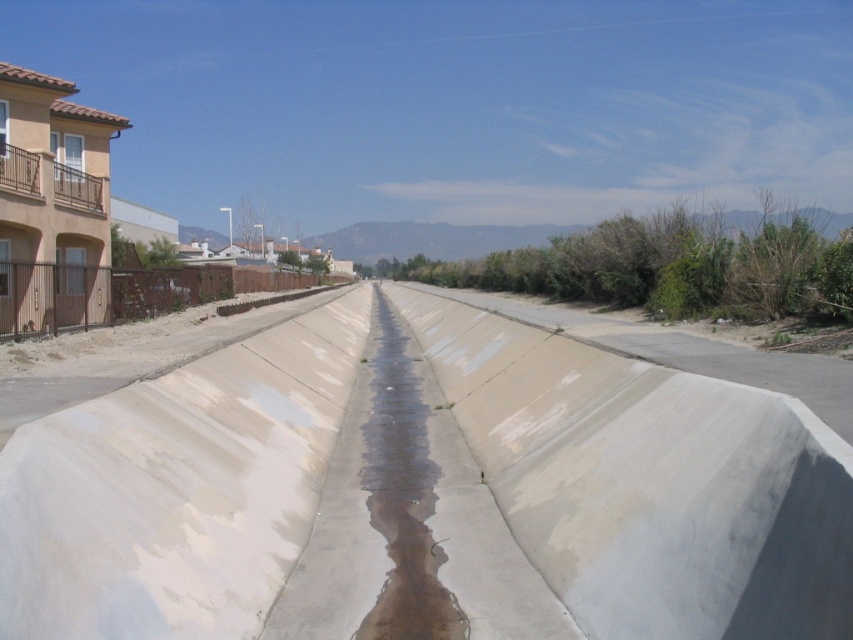
Question: Among these objects, which one is nearest to the camera?

Choices:
 (A) smooth concrete at center
 (B) clear concrete puddle at center

Answer: (A)

Question: Does smooth concrete at center lie in front of clear concrete puddle at center?

Choices:
 (A) no
 (B) yes

Answer: (B)

Question: Does smooth concrete at center have a smaller size compared to clear concrete puddle at center?

Choices:
 (A) no
 (B) yes

Answer: (A)

Question: Does smooth concrete at center appear under clear concrete puddle at center?

Choices:
 (A) no
 (B) yes

Answer: (A)

Question: Which point appears farthest from the camera in this image?

Choices:
 (A) (422, 588)
 (B) (578, 625)

Answer: (A)

Question: Among these objects, which one is nearest to the camera?

Choices:
 (A) clear concrete puddle at center
 (B) smooth concrete at center

Answer: (B)